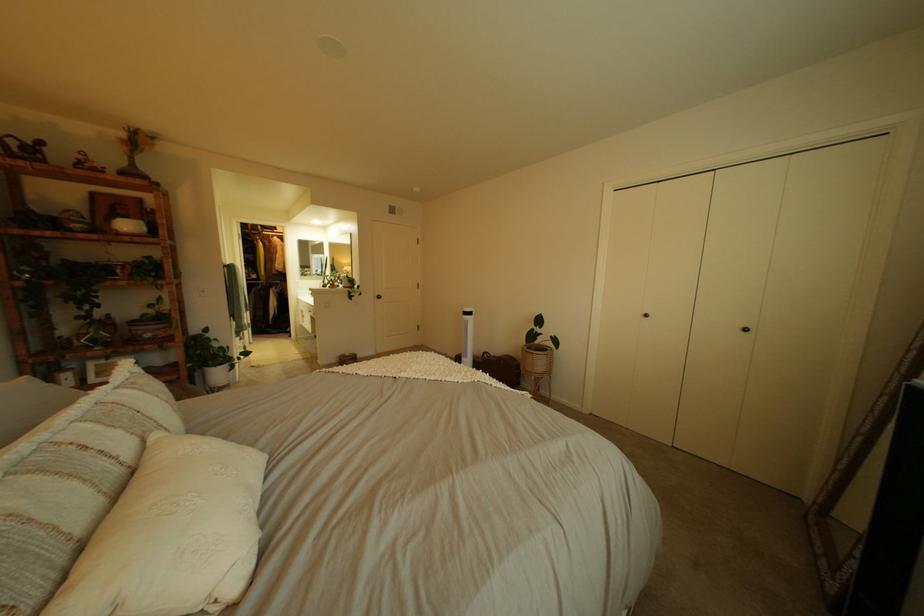
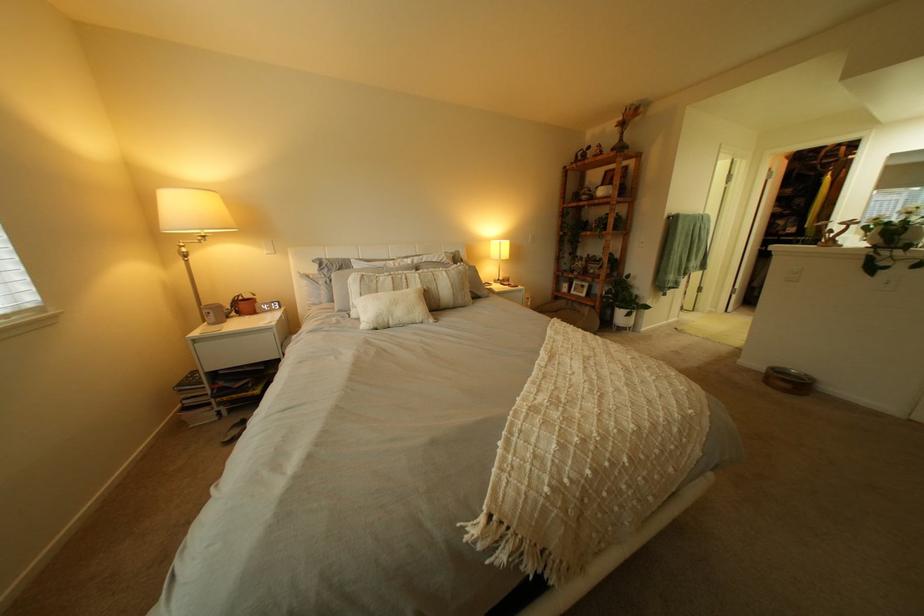
Locate, in the second image, the point that corresponds to the point at 464,379 in the first image.

(541, 387)